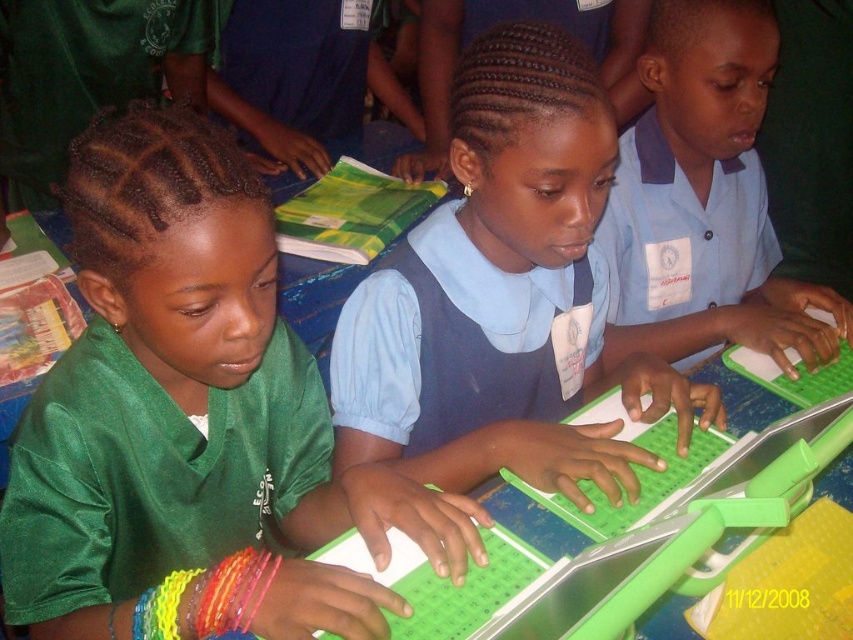
You are a photographer standing at the back of the classroom. You want to take a closeup photo of the green shiny shirt at left without moving any objects. Can you do it with your current camera lens that has a minimum focusing distance of 26 inches?

The green shiny shirt at left is 25.52 inches away from camera, which is less than the minimum focusing distance of 26 inches. Therefore, you cannot take a closeup photo of the green shiny shirt at left with your current camera lens.

In the classroom scene, there is a blue fabric shirt at center and a green plastic laptop at center. Which object is located to the right of the other?

The green plastic laptop at center is to the right of the blue fabric shirt at center because the blue fabric shirt at center is positioned on the left side of the green plastic laptop at center.